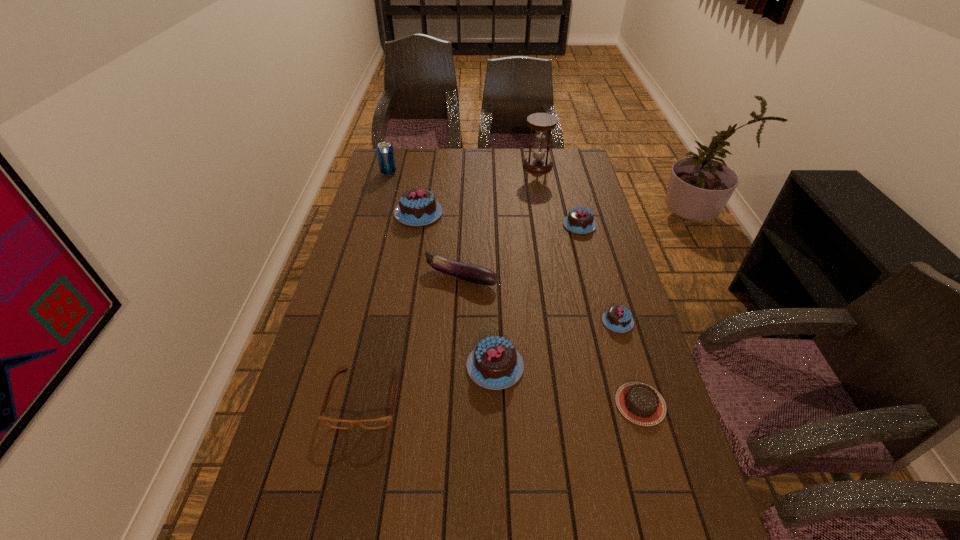
You are a GUI agent. You are given a task and a screenshot of the screen. Output one action in this format:
    pyautogui.click(x=<x>, y=<y>)
    Task: Click on the empty space between the third farthest chocolate cake and the leftmost pink chocolate cake
    The width and height of the screenshot is (960, 540).
    Given the screenshot: What is the action you would take?
    pyautogui.click(x=518, y=267)

Identify which object is the fifth closest to the hourglass. Please provide its 2D coordinates. Your answer should be formatted as a tuple, i.e. [(x, y)], where the tuple contains the x and y coordinates of a point satisfying the conditions above.

[(618, 318)]

At what (x,y) coordinates should I click in order to perform the action: click on object that stands as the third closest to the leftmost chocolate cake. Please return your answer as a coordinate pair (x, y). This screenshot has height=540, width=960. Looking at the image, I should click on (541, 122).

Select which chocolate cake appears as the fifth closest to the beer can. Please provide its 2D coordinates. Your answer should be formatted as a tuple, i.e. [(x, y)], where the tuple contains the x and y coordinates of a point satisfying the conditions above.

[(640, 403)]

The image size is (960, 540). In order to click on chocolate cake that is the closest to the biggest pink chocolate cake in this screenshot , I will do (x=580, y=220).

Where is `pink chocolate cake that is the second closest to the biggest pink chocolate cake`? This screenshot has width=960, height=540. pink chocolate cake that is the second closest to the biggest pink chocolate cake is located at coordinates (495, 364).

At what (x,y) coordinates should I click in order to perform the action: click on the second closest pink chocolate cake to the tallest chocolate cake. Please return your answer as a coordinate pair (x, y). The width and height of the screenshot is (960, 540). Looking at the image, I should click on (495, 364).

The height and width of the screenshot is (540, 960). What are the coordinates of `vacant position in the image that satisfies the following two spatial constraints: 1. on the front-facing side of the spectacles; 2. on the right side of the shortest chocolate cake` in the screenshot? It's located at (364, 404).

The image size is (960, 540). Identify the location of vacant point that satisfies the following two spatial constraints: 1. on the front side of the third tallest object; 2. on the right side of the third farthest pink chocolate cake. (400, 321).

This screenshot has width=960, height=540. In order to click on vacant space that satisfies the following two spatial constraints: 1. on the front-facing side of the spectacles; 2. on the right side of the shortest chocolate cake in this screenshot , I will do `click(364, 404)`.